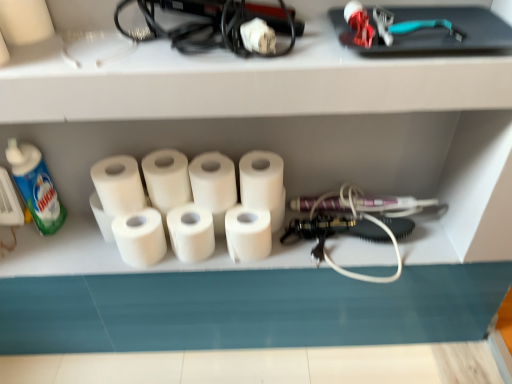
Question: Is white matte toilet paper at center, which appears as the fourth toilet paper when viewed from the right, completely or partially outside of white matte toilet paper at center, which is the 4th toilet paper in left-to-right order?

Choices:
 (A) no
 (B) yes

Answer: (B)

Question: From a real-world perspective, is white matte toilet paper at center, which is counted as the third toilet paper, starting from the left, physically above white matte toilet paper at center, which ranks as the 3th toilet paper in right-to-left order?

Choices:
 (A) yes
 (B) no

Answer: (B)

Question: From the image's perspective, does white matte toilet paper at center, which is counted as the third toilet paper, starting from the left, appear higher than white matte toilet paper at center, which ranks as the 3th toilet paper in right-to-left order?

Choices:
 (A) no
 (B) yes

Answer: (B)

Question: Is white matte toilet paper at center, which appears as the fourth toilet paper when viewed from the right, behind white matte toilet paper at center, which ranks as the 3th toilet paper in right-to-left order?

Choices:
 (A) yes
 (B) no

Answer: (A)

Question: Can you confirm if white matte toilet paper at center, which is counted as the third toilet paper, starting from the left, is wider than white matte toilet paper at center, which is the 4th toilet paper in left-to-right order?

Choices:
 (A) no
 (B) yes

Answer: (A)

Question: Considering the positions of white matte toilet paper at center, the first toilet paper in the right-to-left sequence, and green matte bottle at left in the image, is white matte toilet paper at center, the first toilet paper in the right-to-left sequence, wider or thinner than green matte bottle at left?

Choices:
 (A) thin
 (B) wide

Answer: (B)

Question: Which is correct: white matte toilet paper at center, positioned as the sixth toilet paper in left-to-right order, is inside green matte bottle at left, or outside of it?

Choices:
 (A) inside
 (B) outside

Answer: (B)

Question: Is point pos(278,203) positioned closer to the camera than point pos(29,153)?

Choices:
 (A) closer
 (B) farther

Answer: (B)

Question: Relative to green matte bottle at left, is white matte toilet paper at center, the first toilet paper in the right-to-left sequence, in front or behind?

Choices:
 (A) behind
 (B) front

Answer: (A)

Question: From the image's perspective, is white matte toilet paper at center, marked as the 5th toilet paper in a left-to-right arrangement, above or below white matte paper towel at center?

Choices:
 (A) above
 (B) below

Answer: (A)

Question: Does point (254, 226) appear closer or farther from the camera than point (202, 228)?

Choices:
 (A) closer
 (B) farther

Answer: (A)

Question: Choose the correct answer: Is white matte toilet paper at center, the 2th toilet paper viewed from the right, inside white matte paper towel at center or outside it?

Choices:
 (A) outside
 (B) inside

Answer: (A)

Question: From a real-world perspective, is white matte toilet paper at center, marked as the 5th toilet paper in a left-to-right arrangement, positioned above or below white matte paper towel at center?

Choices:
 (A) below
 (B) above

Answer: (B)

Question: From the image's perspective, is white matte toilet paper at center, which ranks as the 3th toilet paper in right-to-left order, positioned above or below white matte toilet paper at center, the fifth toilet paper positioned from the right?

Choices:
 (A) above
 (B) below

Answer: (A)

Question: Is white matte toilet paper at center, which is the 4th toilet paper in left-to-right order, taller or shorter than white matte toilet paper at center, the fifth toilet paper positioned from the right?

Choices:
 (A) short
 (B) tall

Answer: (B)